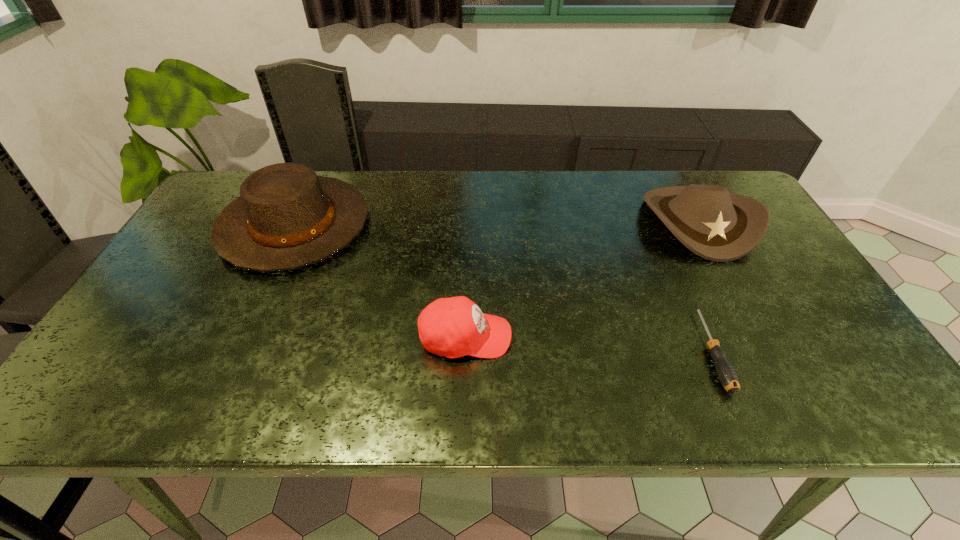
In order to click on vacant space located 0.150m on the back of the screwdriver in this screenshot , I will do `click(674, 266)`.

I want to click on object located in the near edge section of the desktop, so coord(726,373).

The height and width of the screenshot is (540, 960). I want to click on object that is at the left edge, so click(287, 217).

This screenshot has width=960, height=540. Find the location of `object located at the right edge`. object located at the right edge is located at coordinates pyautogui.click(x=719, y=226).

Where is `object that is at the far left corner`? The image size is (960, 540). object that is at the far left corner is located at coordinates (287, 217).

Find the location of a particular element. The image size is (960, 540). object that is at the far right corner is located at coordinates (719, 226).

This screenshot has height=540, width=960. I want to click on free location at the far edge of the desktop, so click(x=606, y=172).

Locate an element on the screen. vacant space at the near edge of the desktop is located at coordinates (563, 400).

What are the coordinates of `vacant space at the left edge of the desktop` in the screenshot? It's located at (212, 248).

In the image, there is a desktop. Where is `vacant region at the right edge`? Image resolution: width=960 pixels, height=540 pixels. vacant region at the right edge is located at coordinates (803, 286).